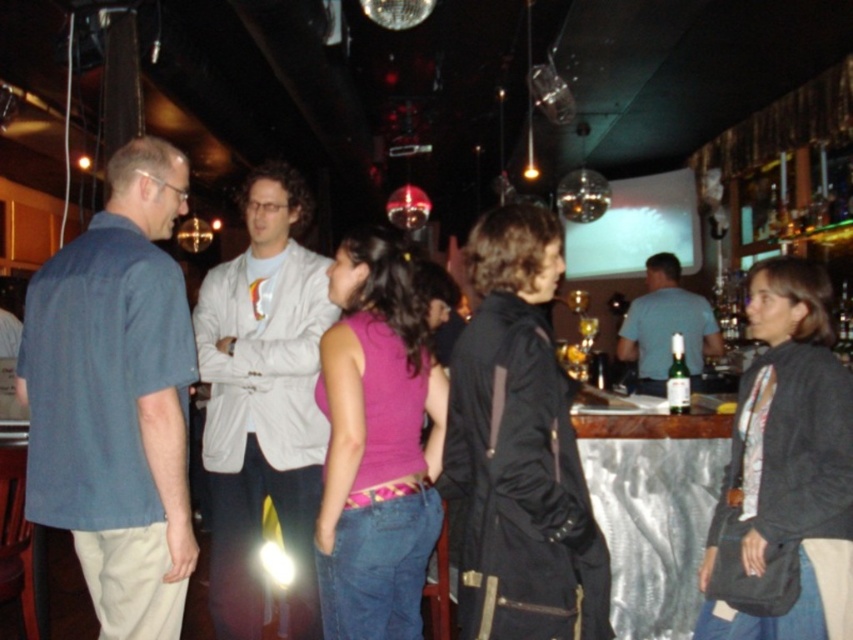
Question: Considering the real-world distances, which object is farthest from the dark gray sweater at center?

Choices:
 (A) light blue shirt at center
 (B) purple matte tank top at center
 (C) light gray fabric jacket at center

Answer: (A)

Question: Can you confirm if dark gray sweater at center is bigger than purple matte tank top at center?

Choices:
 (A) no
 (B) yes

Answer: (B)

Question: Does matte black jacket at center appear over dark gray sweater at center?

Choices:
 (A) no
 (B) yes

Answer: (B)

Question: Is dark gray sweater at center above purple matte tank top at center?

Choices:
 (A) yes
 (B) no

Answer: (B)

Question: Which of these objects is positioned closest to the green glass bottle at bar?

Choices:
 (A) matte black jacket at center
 (B) light gray fabric jacket at center
 (C) light blue shirt at center
 (D) blue cotton shirt at left

Answer: (A)

Question: Which point is closer to the camera taking this photo?

Choices:
 (A) (668, 369)
 (B) (146, 593)
 (C) (718, 513)
 (D) (340, 291)

Answer: (B)